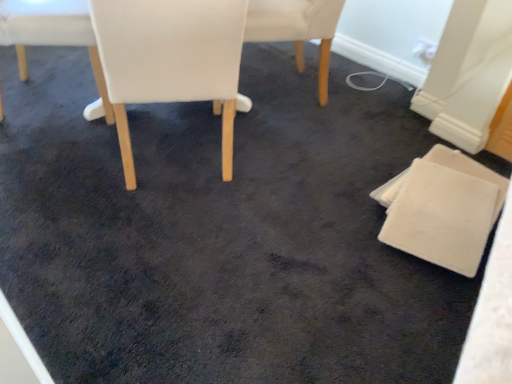
You are a GUI agent. You are given a task and a screenshot of the screen. Output one action in this format:
    pyautogui.click(x=<x>, y=<y>)
    Task: Click on the white felt coaster at lower right, placed as the 1th chair when sorted from right to left
    
    Given the screenshot: What is the action you would take?
    pyautogui.click(x=442, y=209)

The image size is (512, 384). In order to click on white leather chair at center, the 2th chair viewed from the left in this screenshot , I will do `click(170, 60)`.

At what (x,y) coordinates should I click in order to perform the action: click on white fabric chair at upper left, acting as the 4th chair starting from the right. Please return your answer as a coordinate pair (x, y). Image resolution: width=512 pixels, height=384 pixels. Looking at the image, I should click on (52, 33).

Find the location of a particular element. white leather chair at center, marked as the 2th chair in a right-to-left arrangement is located at coordinates (296, 29).

Is white leather chair at center, the 2th chair viewed from the left, located within white felt coaster at lower right, placed as the 1th chair when sorted from right to left?

No.

Considering the sizes of objects white felt coaster at lower right, placed as the 1th chair when sorted from right to left, and white leather chair at center, arranged as the third chair when viewed from the right, in the image provided, who is bigger, white felt coaster at lower right, placed as the 1th chair when sorted from right to left, or white leather chair at center, arranged as the third chair when viewed from the right,?

white leather chair at center, arranged as the third chair when viewed from the right, is bigger.

Is white felt coaster at lower right, placed as the 1th chair when sorted from right to left, far from white leather chair at center, the 2th chair viewed from the left?

white felt coaster at lower right, placed as the 1th chair when sorted from right to left, is near white leather chair at center, the 2th chair viewed from the left, not far away.

From a real-world perspective, relative to white leather chair at center, arranged as the third chair when viewed from the right, is white felt coaster at lower right, which appears as the fourth chair when viewed from the left, vertically above or below?

In terms of real-world spatial position, white felt coaster at lower right, which appears as the fourth chair when viewed from the left, is below white leather chair at center, arranged as the third chair when viewed from the right.

Is white leather chair at center, the 2th chair viewed from the left, far away from white felt coaster at lower right, which appears as the fourth chair when viewed from the left?

white leather chair at center, the 2th chair viewed from the left, is near white felt coaster at lower right, which appears as the fourth chair when viewed from the left, not far away.

How far apart are white leather chair at center, the 2th chair viewed from the left, and white felt coaster at lower right, which appears as the fourth chair when viewed from the left?

white leather chair at center, the 2th chair viewed from the left, is 85.62 centimeters from white felt coaster at lower right, which appears as the fourth chair when viewed from the left.

Do you think white leather chair at center, the 2th chair viewed from the left, is within white felt coaster at lower right, placed as the 1th chair when sorted from right to left, or outside of it?

white leather chair at center, the 2th chair viewed from the left, is outside white felt coaster at lower right, placed as the 1th chair when sorted from right to left.

From the picture: From the image's perspective, would you say white leather chair at center, the 2th chair viewed from the left, is positioned over white felt coaster at lower right, placed as the 1th chair when sorted from right to left?

Yes, from the image's perspective, white leather chair at center, the 2th chair viewed from the left, is on top of white felt coaster at lower right, placed as the 1th chair when sorted from right to left.

How far apart are white felt coaster at lower right, placed as the 1th chair when sorted from right to left, and white fabric chair at upper left, placed as the 1th chair when sorted from left to right?

A distance of 1.27 meters exists between white felt coaster at lower right, placed as the 1th chair when sorted from right to left, and white fabric chair at upper left, placed as the 1th chair when sorted from left to right.

Considering the sizes of objects white felt coaster at lower right, placed as the 1th chair when sorted from right to left, and white fabric chair at upper left, placed as the 1th chair when sorted from left to right, in the image provided, who is smaller, white felt coaster at lower right, placed as the 1th chair when sorted from right to left, or white fabric chair at upper left, placed as the 1th chair when sorted from left to right,?

With smaller size is white felt coaster at lower right, placed as the 1th chair when sorted from right to left.

This screenshot has width=512, height=384. Identify the location of the 2nd chair located above the white felt coaster at lower right, which appears as the fourth chair when viewed from the left (from a real-world perspective). (52, 33).

Considering the relative sizes of white felt coaster at lower right, placed as the 1th chair when sorted from right to left, and white fabric chair at upper left, placed as the 1th chair when sorted from left to right, in the image provided, is white felt coaster at lower right, placed as the 1th chair when sorted from right to left, thinner than white fabric chair at upper left, placed as the 1th chair when sorted from left to right,?

Correct, the width of white felt coaster at lower right, placed as the 1th chair when sorted from right to left, is less than that of white fabric chair at upper left, placed as the 1th chair when sorted from left to right.

Is white leather chair at center, the third chair viewed from the left, outside of white fabric chair at upper left, acting as the 4th chair starting from the right?

Yes, white leather chair at center, the third chair viewed from the left, is outside of white fabric chair at upper left, acting as the 4th chair starting from the right.

From a real-world perspective, relative to white fabric chair at upper left, acting as the 4th chair starting from the right, is white leather chair at center, marked as the 2th chair in a right-to-left arrangement, vertically above or below?

white leather chair at center, marked as the 2th chair in a right-to-left arrangement, is below white fabric chair at upper left, acting as the 4th chair starting from the right.

Which object is thinner, white leather chair at center, marked as the 2th chair in a right-to-left arrangement, or white fabric chair at upper left, acting as the 4th chair starting from the right?

With smaller width is white fabric chair at upper left, acting as the 4th chair starting from the right.

Is point (274, 34) more distant than point (73, 2)?

Yes, point (274, 34) is farther from viewer.

From the image's perspective, does white fabric chair at upper left, placed as the 1th chair when sorted from left to right, appear higher than white leather chair at center, arranged as the third chair when viewed from the right?

Indeed, from the image's perspective, white fabric chair at upper left, placed as the 1th chair when sorted from left to right, is shown above white leather chair at center, arranged as the third chair when viewed from the right.

Considering the positions of point (47, 24) and point (164, 49), is point (47, 24) closer or farther from the camera than point (164, 49)?

Point (47, 24) is positioned farther from the camera compared to point (164, 49).

Based on the photo, is white leather chair at center, the 2th chair viewed from the left, completely or partially inside white fabric chair at upper left, placed as the 1th chair when sorted from left to right?

No, white fabric chair at upper left, placed as the 1th chair when sorted from left to right, does not contain white leather chair at center, the 2th chair viewed from the left.

Who is taller, white fabric chair at upper left, placed as the 1th chair when sorted from left to right, or white leather chair at center, arranged as the third chair when viewed from the right?

Standing taller between the two is white leather chair at center, arranged as the third chair when viewed from the right.

Are white felt coaster at lower right, placed as the 1th chair when sorted from right to left, and white leather chair at center, marked as the 2th chair in a right-to-left arrangement, far apart?

They are positioned close to each other.

From a real-world perspective, is white felt coaster at lower right, placed as the 1th chair when sorted from right to left, physically located above or below white leather chair at center, the third chair viewed from the left?

Clearly, from a real-world perspective, white felt coaster at lower right, placed as the 1th chair when sorted from right to left, is below white leather chair at center, the third chair viewed from the left.

Is white felt coaster at lower right, placed as the 1th chair when sorted from right to left, oriented towards white leather chair at center, the third chair viewed from the left?

No, white felt coaster at lower right, placed as the 1th chair when sorted from right to left, does not turn towards white leather chair at center, the third chair viewed from the left.

Can you tell me how much white leather chair at center, the third chair viewed from the left, and white felt coaster at lower right, placed as the 1th chair when sorted from right to left, differ in facing direction?

The angular difference between white leather chair at center, the third chair viewed from the left, and white felt coaster at lower right, placed as the 1th chair when sorted from right to left, is 136 degrees.

From the picture: Considering the relative sizes of white leather chair at center, marked as the 2th chair in a right-to-left arrangement, and white felt coaster at lower right, which appears as the fourth chair when viewed from the left, in the image provided, is white leather chair at center, marked as the 2th chair in a right-to-left arrangement, bigger than white felt coaster at lower right, which appears as the fourth chair when viewed from the left,?

Yes.

Is point (301, 66) closer or farther from the camera than point (464, 244)?

Point (301, 66) appears to be farther away from the viewer than point (464, 244).

Considering the relative sizes of white leather chair at center, the third chair viewed from the left, and white felt coaster at lower right, which appears as the fourth chair when viewed from the left, in the image provided, is white leather chair at center, the third chair viewed from the left, thinner than white felt coaster at lower right, which appears as the fourth chair when viewed from the left,?

No, white leather chair at center, the third chair viewed from the left, is not thinner than white felt coaster at lower right, which appears as the fourth chair when viewed from the left.

Image resolution: width=512 pixels, height=384 pixels. Identify the location of the 2nd chair to the right of the white leather chair at center, the 2th chair viewed from the left, counting from the anchor's position. (442, 209).

Identify the location of chair in front of the white felt coaster at lower right, which appears as the fourth chair when viewed from the left. pyautogui.click(x=170, y=60).

In the scene shown: When comparing their distances from white felt coaster at lower right, which appears as the fourth chair when viewed from the left, does white fabric chair at upper left, placed as the 1th chair when sorted from left to right, or white leather chair at center, the 2th chair viewed from the left, seem further?

white fabric chair at upper left, placed as the 1th chair when sorted from left to right, is further to white felt coaster at lower right, which appears as the fourth chair when viewed from the left.

Looking at the image, which one is located further to white fabric chair at upper left, acting as the 4th chair starting from the right, white leather chair at center, marked as the 2th chair in a right-to-left arrangement, or white leather chair at center, the 2th chair viewed from the left?

The object further to white fabric chair at upper left, acting as the 4th chair starting from the right, is white leather chair at center, marked as the 2th chair in a right-to-left arrangement.

Looking at the image, which one is located further to white leather chair at center, the 2th chair viewed from the left, white fabric chair at upper left, acting as the 4th chair starting from the right, or white felt coaster at lower right, which appears as the fourth chair when viewed from the left?

white felt coaster at lower right, which appears as the fourth chair when viewed from the left, lies further to white leather chair at center, the 2th chair viewed from the left, than the other object.

Based on their spatial positions, is white fabric chair at upper left, placed as the 1th chair when sorted from left to right, or white felt coaster at lower right, placed as the 1th chair when sorted from right to left, further from white leather chair at center, marked as the 2th chair in a right-to-left arrangement?

white felt coaster at lower right, placed as the 1th chair when sorted from right to left, is positioned further to the anchor white leather chair at center, marked as the 2th chair in a right-to-left arrangement.

Estimate the real-world distances between objects in this image. Which object is closer to white fabric chair at upper left, acting as the 4th chair starting from the right, white felt coaster at lower right, which appears as the fourth chair when viewed from the left, or white leather chair at center, the third chair viewed from the left?

white leather chair at center, the third chair viewed from the left, is positioned closer to the anchor white fabric chair at upper left, acting as the 4th chair starting from the right.

Looking at the image, which one is located closer to white leather chair at center, the 2th chair viewed from the left, white felt coaster at lower right, which appears as the fourth chair when viewed from the left, or white leather chair at center, marked as the 2th chair in a right-to-left arrangement?

white leather chair at center, marked as the 2th chair in a right-to-left arrangement, is positioned closer to the anchor white leather chair at center, the 2th chair viewed from the left.

Estimate the real-world distances between objects in this image. Which object is closer to white fabric chair at upper left, acting as the 4th chair starting from the right, white leather chair at center, arranged as the third chair when viewed from the right, or white felt coaster at lower right, placed as the 1th chair when sorted from right to left?

white leather chair at center, arranged as the third chair when viewed from the right, is positioned closer to the anchor white fabric chair at upper left, acting as the 4th chair starting from the right.

Looking at the image, which one is located closer to white felt coaster at lower right, placed as the 1th chair when sorted from right to left, white fabric chair at upper left, acting as the 4th chair starting from the right, or white leather chair at center, the third chair viewed from the left?

The object closer to white felt coaster at lower right, placed as the 1th chair when sorted from right to left, is white leather chair at center, the third chair viewed from the left.

The width and height of the screenshot is (512, 384). Identify the location of chair between white leather chair at center, arranged as the third chair when viewed from the right, and white felt coaster at lower right, which appears as the fourth chair when viewed from the left, from left to right. (296, 29).

Identify the location of chair located between white fabric chair at upper left, placed as the 1th chair when sorted from left to right, and white leather chair at center, marked as the 2th chair in a right-to-left arrangement, in the left-right direction. Image resolution: width=512 pixels, height=384 pixels. (170, 60).